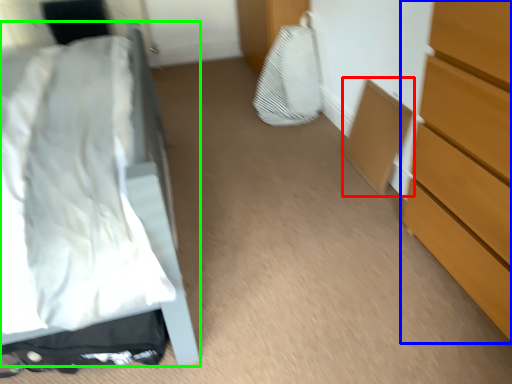
Question: Which object is positioned closest to cabinetry (highlighted by a red box)? Select from chest of drawers (highlighted by a blue box) and bed (highlighted by a green box).

Choices:
 (A) chest of drawers
 (B) bed

Answer: (A)